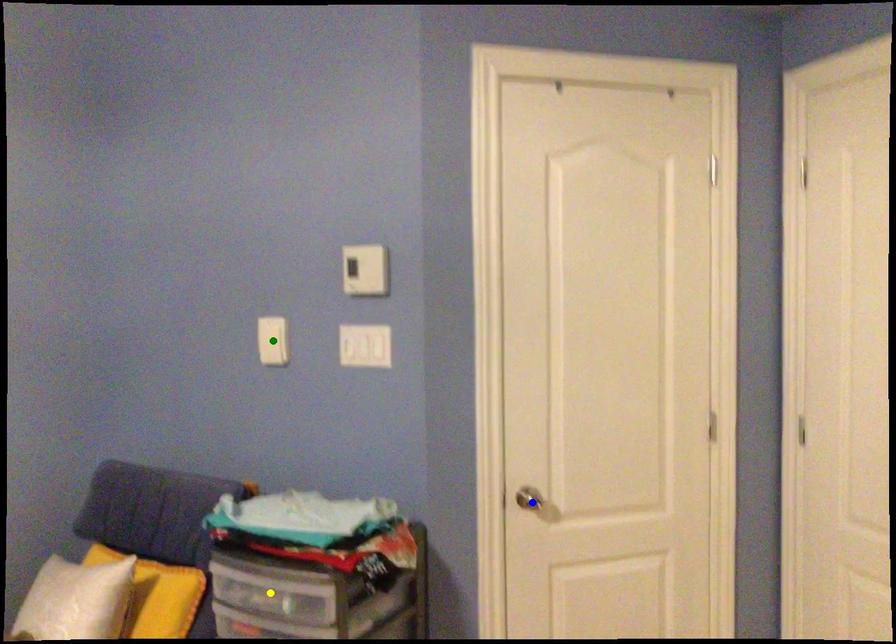
Order these from farthest to nearest:
yellow point | blue point | green point

green point
blue point
yellow point